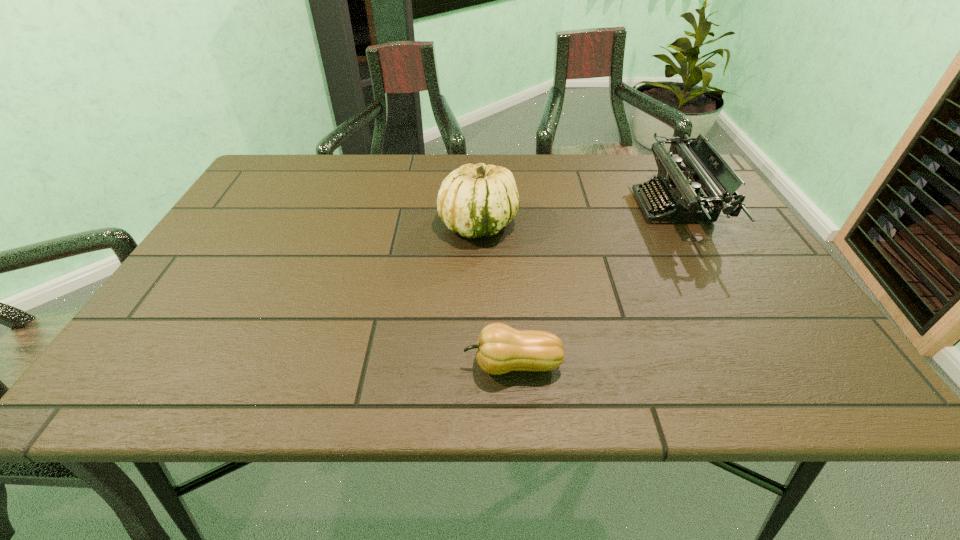
The width and height of the screenshot is (960, 540). I want to click on free space between the typewriter and the farther gourd, so click(x=575, y=215).

Locate an element on the screen. This screenshot has height=540, width=960. vacant point located between the taller gourd and the typewriter is located at coordinates (575, 215).

Find the location of a particular element. The width and height of the screenshot is (960, 540). vacant space that's between the typewriter and the shorter gourd is located at coordinates (592, 286).

Find the location of a particular element. empty space that is in between the rightmost object and the nearest object is located at coordinates tap(592, 286).

Identify the location of vacant area that lies between the nearest object and the typewriter. The width and height of the screenshot is (960, 540). (592, 286).

Where is `empty location between the taller gourd and the rightmost object`? The height and width of the screenshot is (540, 960). empty location between the taller gourd and the rightmost object is located at coordinates (575, 215).

Identify the location of vacant area that lies between the typewriter and the nearest object. (592, 286).

This screenshot has width=960, height=540. What are the coordinates of `empty location between the taller gourd and the typewriter` in the screenshot? It's located at (575, 215).

At what (x,y) coordinates should I click in order to perform the action: click on free space between the taller gourd and the nearest object. Please return your answer as a coordinate pair (x, y). The image size is (960, 540). Looking at the image, I should click on tap(495, 294).

Select which object appears as the closest to the taller gourd. Please provide its 2D coordinates. Your answer should be formatted as a tuple, i.e. [(x, y)], where the tuple contains the x and y coordinates of a point satisfying the conditions above.

[(500, 349)]